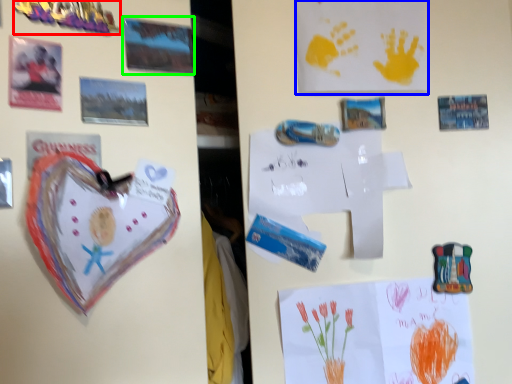
Question: Considering the real-world distances, which object is farthest from toy (highlighted by a red box)? postcard (highlighted by a blue box) or postcard (highlighted by a green box)?

Choices:
 (A) postcard
 (B) postcard

Answer: (A)